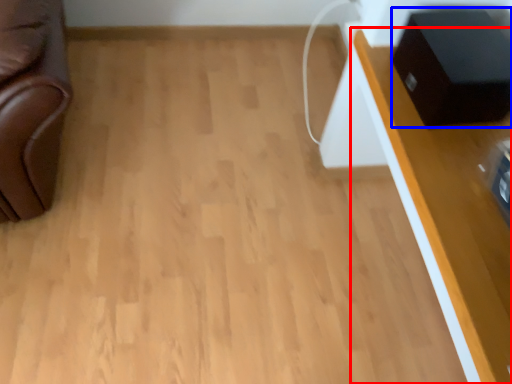
Question: Among these objects, which one is farthest to the camera, table (highlighted by a red box) or speaker (highlighted by a blue box)?

Choices:
 (A) table
 (B) speaker

Answer: (B)